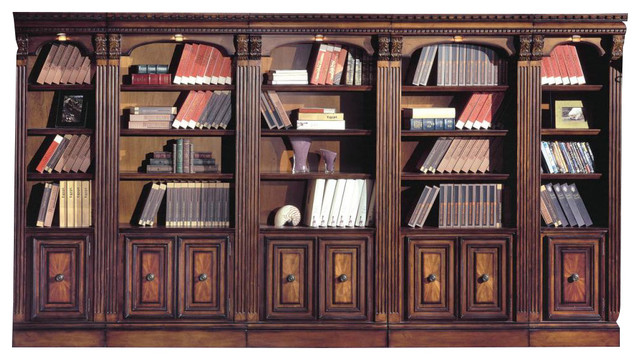
Locate an element on the screen. The width and height of the screenshot is (640, 360). knobs is located at coordinates (56, 276), (148, 275), (202, 278), (292, 275), (344, 275), (435, 277), (483, 278), (578, 275).